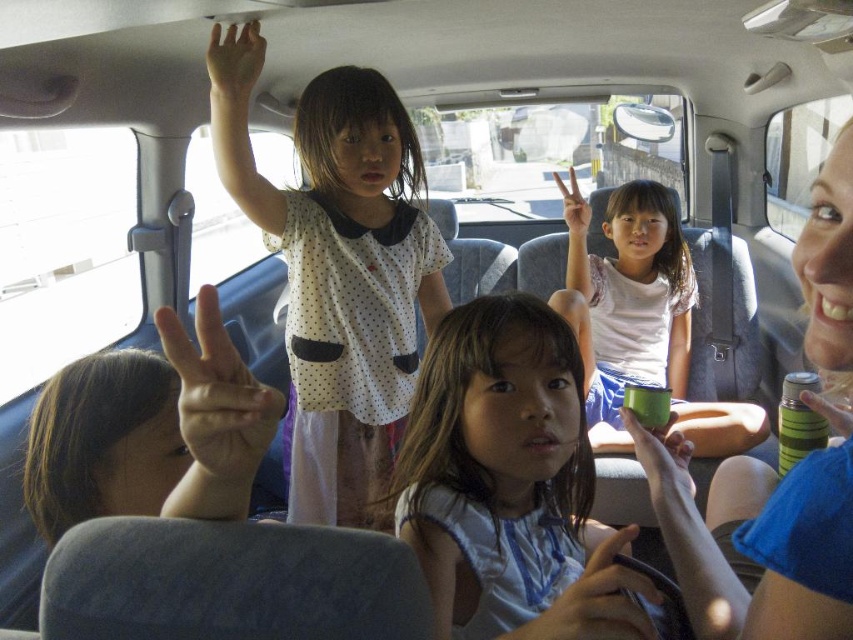
Question: Does white dotted dress at center have a greater width compared to matte skin hand at upper center?

Choices:
 (A) no
 (B) yes

Answer: (B)

Question: Which point appears farthest from the camera in this image?

Choices:
 (A) (827, 307)
 (B) (589, 220)

Answer: (B)

Question: Considering the real-world distances, which object is closest to the matte green thermos at center?

Choices:
 (A) smooth black steering wheel at center
 (B) light blue fabric shirt at center
 (C) green matte cup at center
 (D) matte green cup at center

Answer: (B)

Question: Which object is positioned farthest from the light blue fabric shirt at center?

Choices:
 (A) white dotted dress at center
 (B) matte skin hand at upper center
 (C) matte green thermos at center

Answer: (B)

Question: Can you confirm if white dotted dress at center is bigger than green matte cup at center?

Choices:
 (A) no
 (B) yes

Answer: (B)

Question: Can you confirm if matte green cup at center is thinner than green matte cup at center?

Choices:
 (A) yes
 (B) no

Answer: (B)